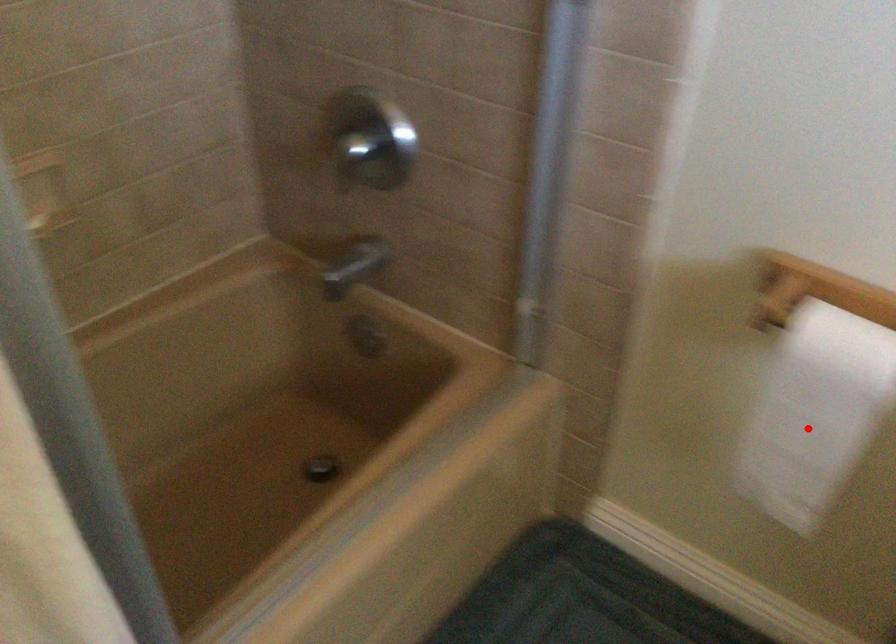
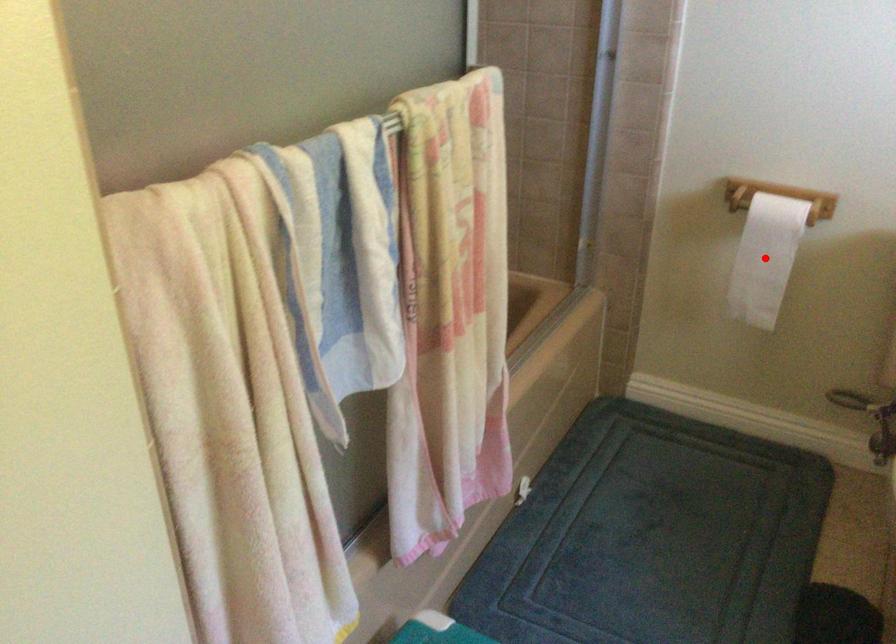
In the scene shown: I am providing you with two images of the same scene from different viewpoints. A red point is marked on the first image and another point is marked on the second image. Are the points marked in image1 and image2 representing the same 3D position?

Yes